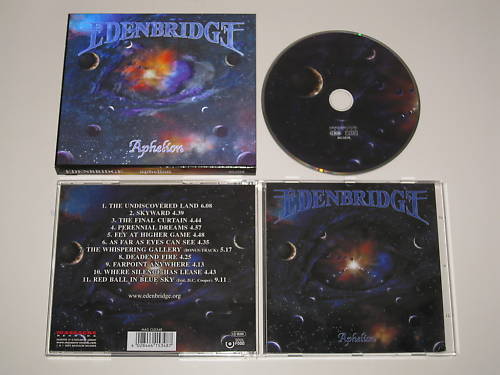
Where is `cd case front`? The image size is (500, 375). cd case front is located at coordinates (361, 247).